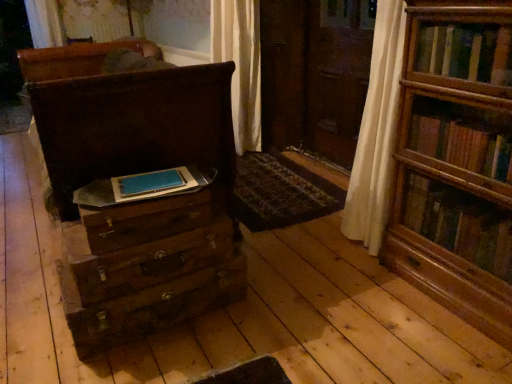
Locate an element on the screen. This screenshot has height=384, width=512. vacant space that is to the left of wooden bookshelf at right is located at coordinates (359, 295).